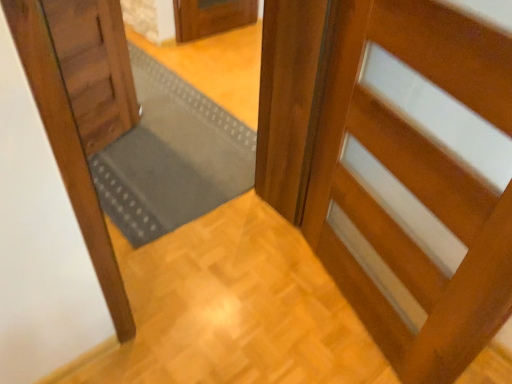
The image size is (512, 384). I want to click on vacant space to the right of wooden door at left, positioned as the second door in right-to-left order, so click(x=175, y=153).